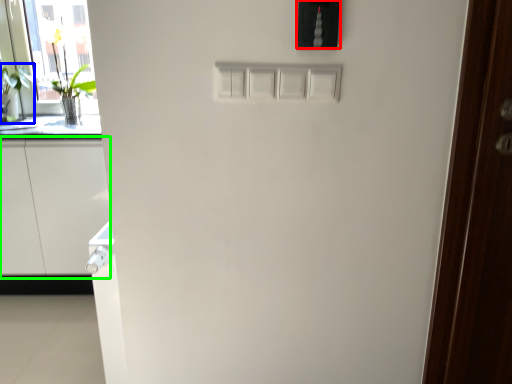
Question: Considering the real-world distances, which object is farthest from light switch (highlighted by a red box)? plant (highlighted by a blue box) or cabinetry (highlighted by a green box)?

Choices:
 (A) plant
 (B) cabinetry

Answer: (A)